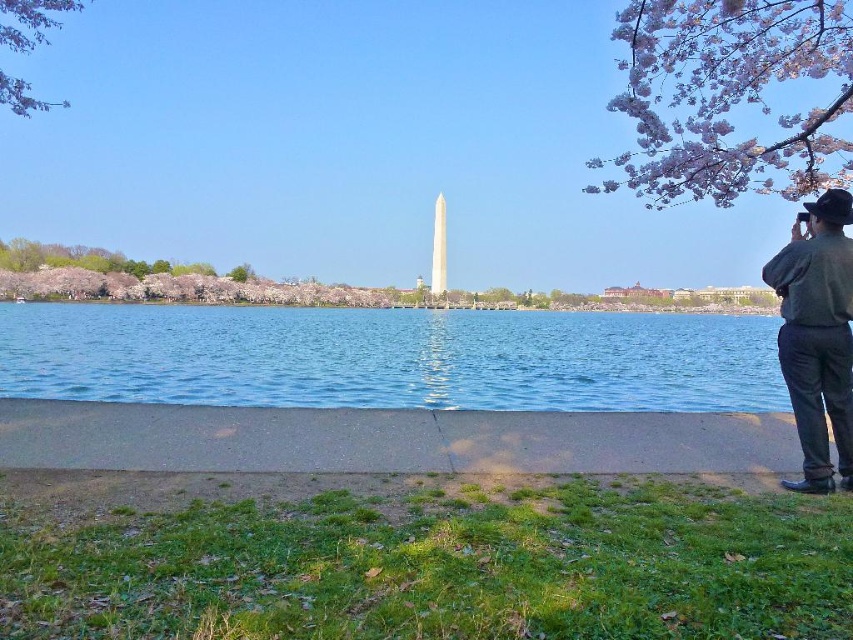
Is point (555, 358) farther from camera compared to point (795, 352)?

Yes, it is behind point (795, 352).

Is clear blue water at center wider than dark green shirt at right?

Indeed, clear blue water at center has a greater width compared to dark green shirt at right.

Is point (567, 312) closer to camera compared to point (776, 339)?

That is False.

The image size is (853, 640). In order to click on clear blue water at center in this screenshot , I will do `click(390, 356)`.

Does green leafy tree at upper left have a greater width compared to green leafy tree at center?

Yes.

Which is in front, point (15, 104) or point (241, 278)?

Point (15, 104) is in front.

Locate an element on the screen. The height and width of the screenshot is (640, 853). green leafy tree at upper left is located at coordinates (30, 20).

Is peachy blossom branch at upper right to the right of green leafy tree at upper left from the viewer's perspective?

Correct, you'll find peachy blossom branch at upper right to the right of green leafy tree at upper left.

Is peachy blossom branch at upper right above green leafy tree at upper left?

No.

This screenshot has height=640, width=853. Find the location of `peachy blossom branch at upper right`. peachy blossom branch at upper right is located at coordinates (728, 97).

I want to click on peachy blossom branch at upper right, so coord(728,97).